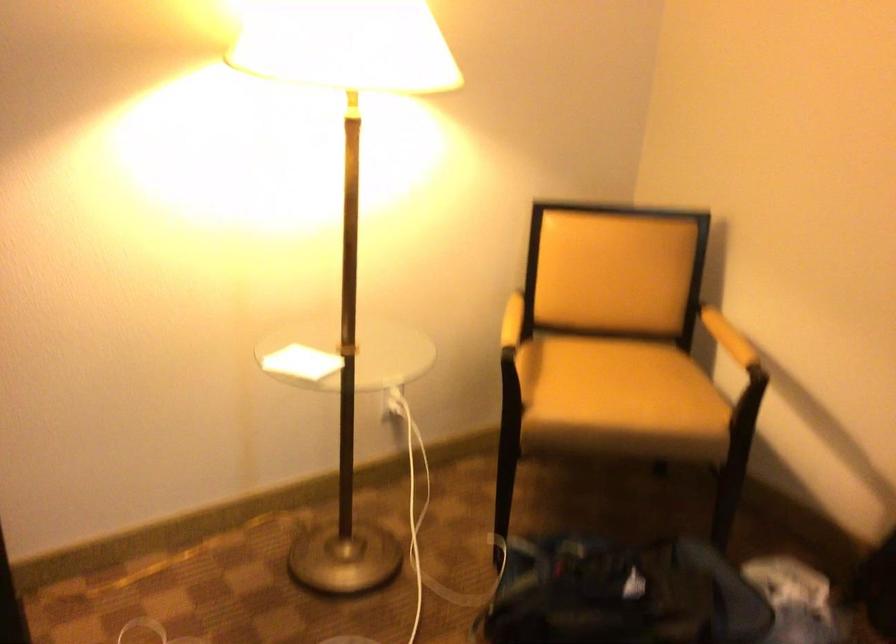
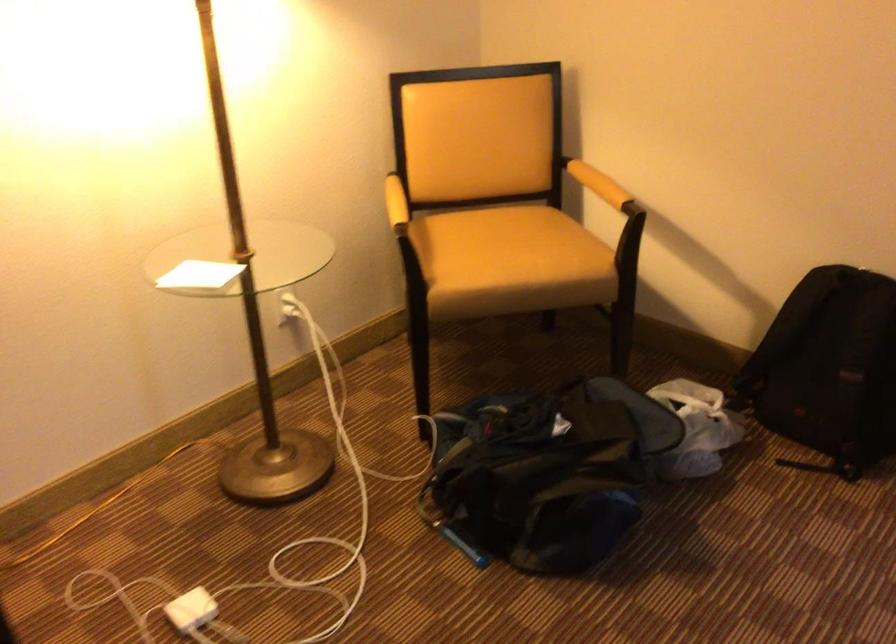
Where in the second image is the point corresponding to the point at 722,334 from the first image?

(598, 184)